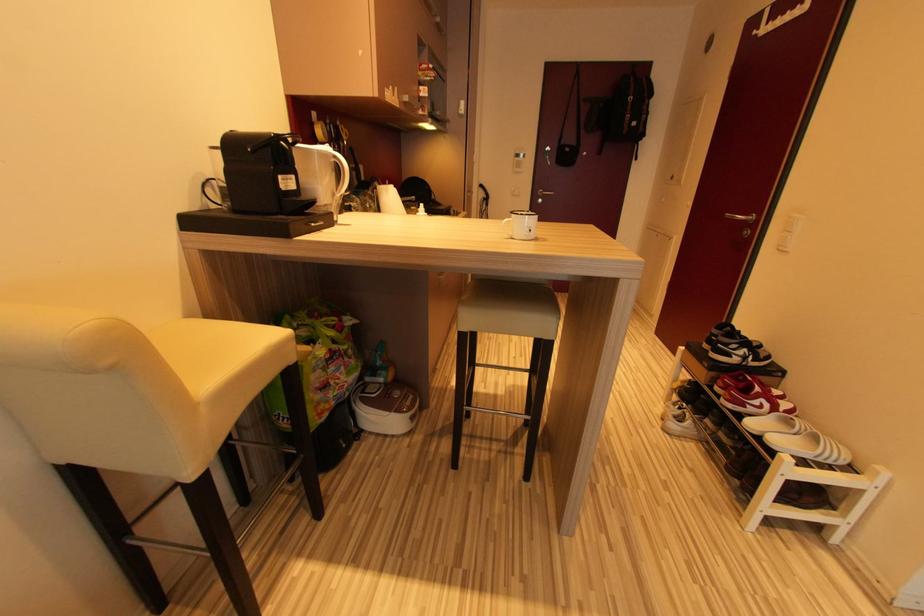
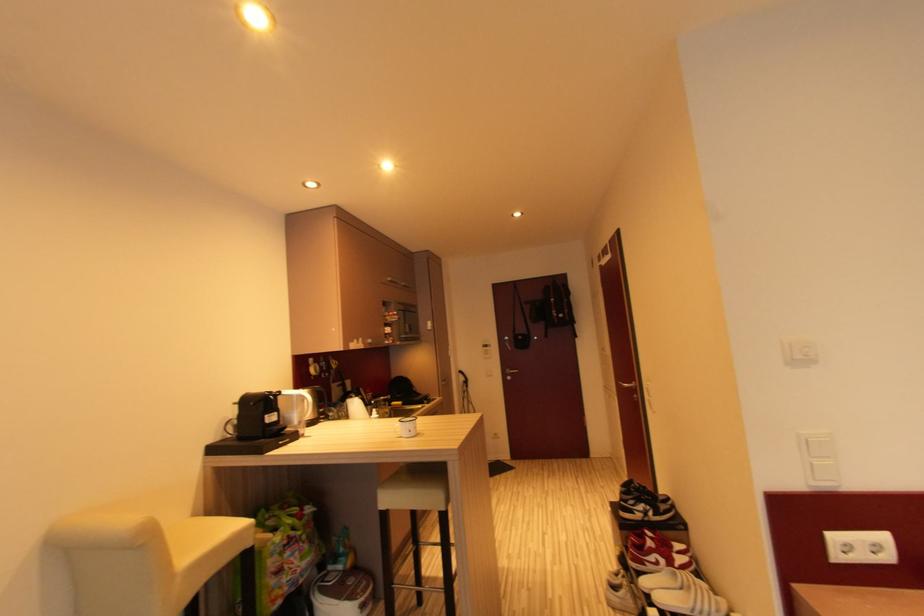
Question: The first image is from the beginning of the video and the second image is from the end. How did the camera likely rotate when shooting the video?

Choices:
 (A) Left
 (B) Right
 (C) Up
 (D) Down

Answer: (C)